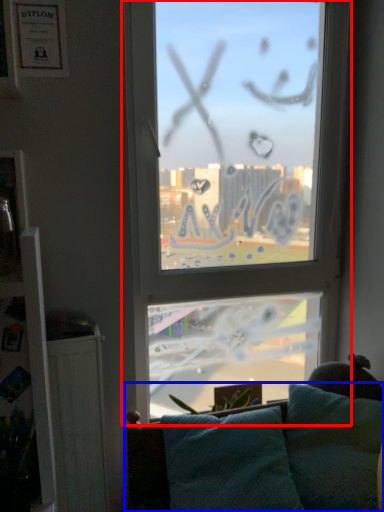
Question: Which point is closer to the camera, window (highlighted by a red box) or studio couch (highlighted by a blue box)?

Choices:
 (A) window
 (B) studio couch

Answer: (B)